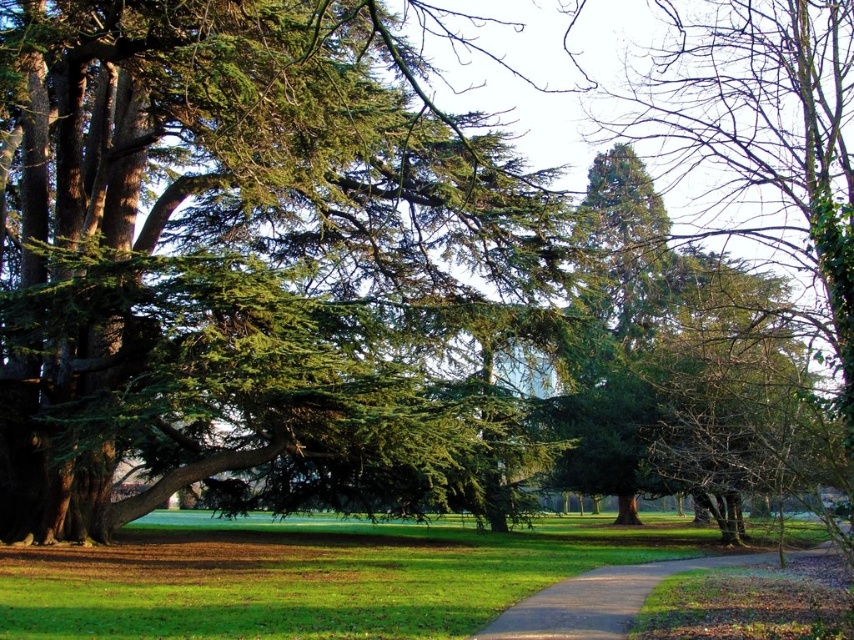
In the scene shown: You are standing at the point labeled as point (243, 253) in the park. What do you see immediately around you?

You see green needle like foliage at center around you.

Consider the image. You are standing in the park and want to walk from the point at coordinates (133, 113) to the point at coordinates (159, 586). Which direction should you move to get closer to your destination?

To move from point (133, 113) to point (159, 586), you should move towards the right since point (159, 586) is located to the right of point (133, 113).